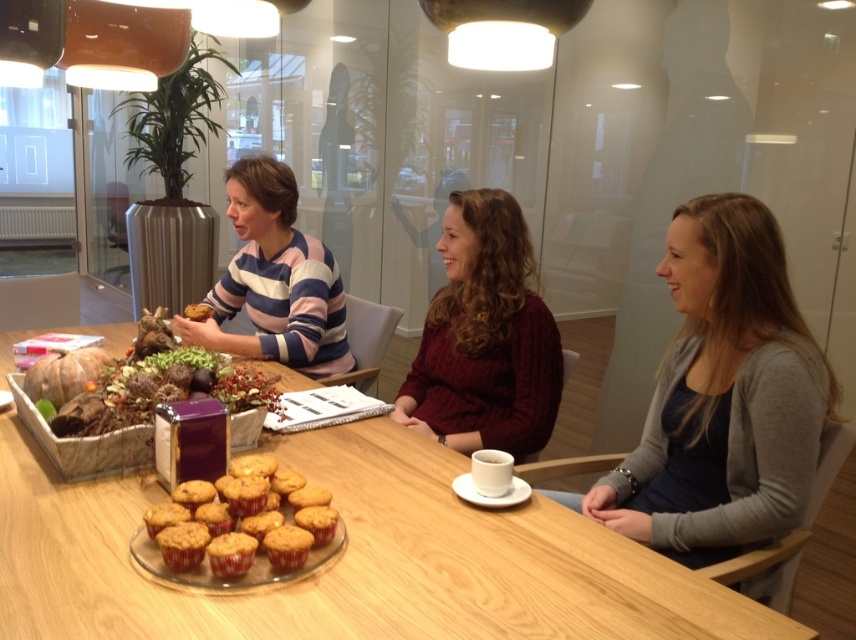
You are a delivery robot that needs to deliver a package to the person wearing the striped sweater at center. The robot has a maximum delivery range of 2 meters. Can the robot successfully deliver the package?

The distance between the striped sweater at center and the camera is 2.15 meters, which exceeds the robot s maximum delivery range of 2 meters. Therefore, the robot cannot successfully deliver the package to the striped sweater at center.